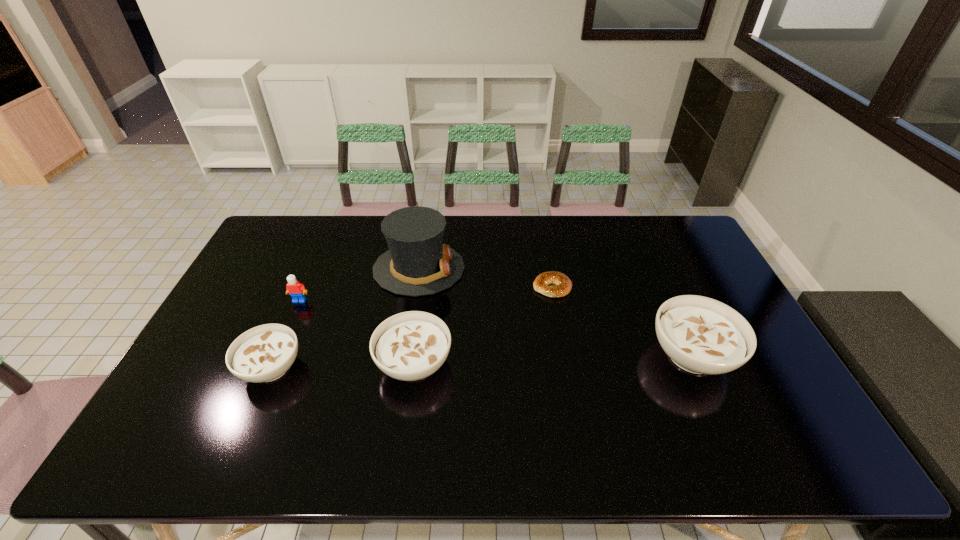
You are a GUI agent. You are given a task and a screenshot of the screen. Output one action in this format:
    pyautogui.click(x=<x>, y=<y>)
    Task: Click on the vacant point located between the tallest object and the bagel
    
    Given the screenshot: What is the action you would take?
    pyautogui.click(x=486, y=278)

This screenshot has height=540, width=960. In order to click on free spot between the Lego and the tallest object in this screenshot , I will do `click(359, 285)`.

The image size is (960, 540). I want to click on object that is the second closest one to the bagel, so click(x=417, y=263).

Locate which object ranks in proximity to the second shortest soup bowl. Please provide its 2D coordinates. Your answer should be formatted as a tuple, i.e. [(x, y)], where the tuple contains the x and y coordinates of a point satisfying the conditions above.

[(417, 263)]

Where is `soup bowl object that ranks as the second closest to the rightmost soup bowl`? The height and width of the screenshot is (540, 960). soup bowl object that ranks as the second closest to the rightmost soup bowl is located at coordinates (264, 353).

In order to click on soup bowl object that ranks as the second closest to the dress hat in this screenshot , I will do `click(264, 353)`.

Where is `free region that satisfies the following two spatial constraints: 1. on the face of the second soup bowl from right to left; 2. on the right side of the Lego`? The width and height of the screenshot is (960, 540). free region that satisfies the following two spatial constraints: 1. on the face of the second soup bowl from right to left; 2. on the right side of the Lego is located at coordinates (273, 363).

Image resolution: width=960 pixels, height=540 pixels. Identify the location of free spot that satisfies the following two spatial constraints: 1. on the back side of the fifth tallest object; 2. on the right side of the rightmost object. (276, 355).

You are a GUI agent. You are given a task and a screenshot of the screen. Output one action in this format:
    pyautogui.click(x=<x>, y=<y>)
    Task: Click on the vacant space that satisfies the following two spatial constraints: 1. on the face of the leftmost soup bowl; 2. on the left side of the Lego
    Image resolution: width=960 pixels, height=540 pixels.
    Given the screenshot: What is the action you would take?
    pyautogui.click(x=271, y=368)

You are a GUI agent. You are given a task and a screenshot of the screen. Output one action in this format:
    pyautogui.click(x=<x>, y=<y>)
    Task: Click on the free region that satisfies the following two spatial constraints: 1. with goggles on the front of the tallest object; 2. on the face of the Lego
    This screenshot has height=540, width=960.
    Given the screenshot: What is the action you would take?
    pyautogui.click(x=414, y=301)